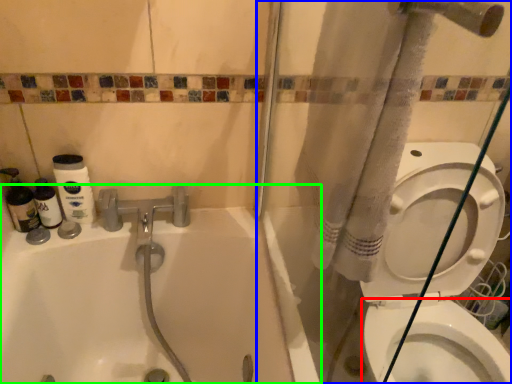
Question: Which is nearer to the bidet (highlighted by a red box)? shower door (highlighted by a blue box) or bathtub (highlighted by a green box).

Choices:
 (A) shower door
 (B) bathtub

Answer: (A)